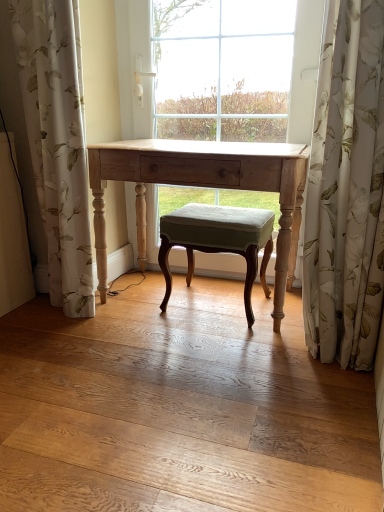
Image resolution: width=384 pixels, height=512 pixels. What are the coordinates of `free spot in front of velvet green stool at center` in the screenshot? It's located at (218, 344).